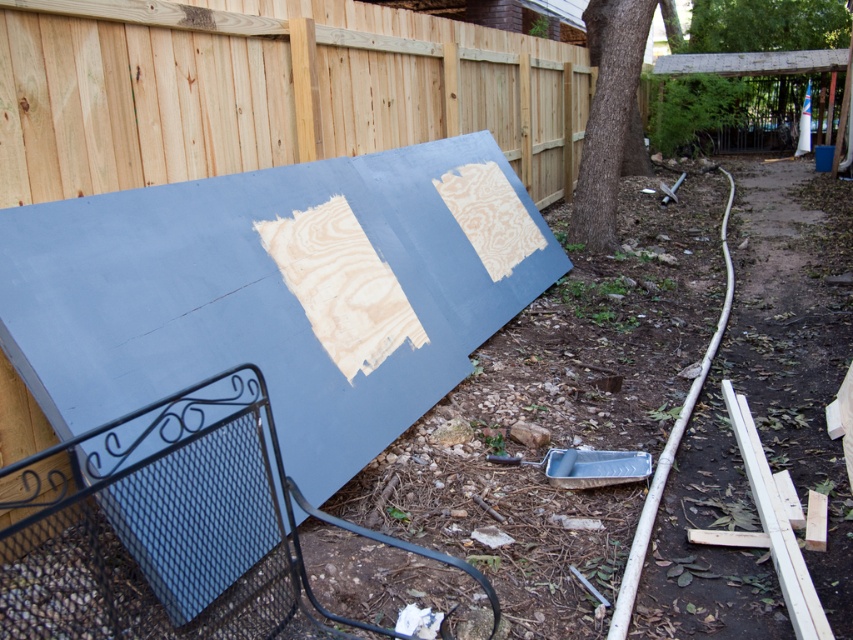
The image size is (853, 640). I want to click on brown rough bark tree at center, so click(x=610, y=116).